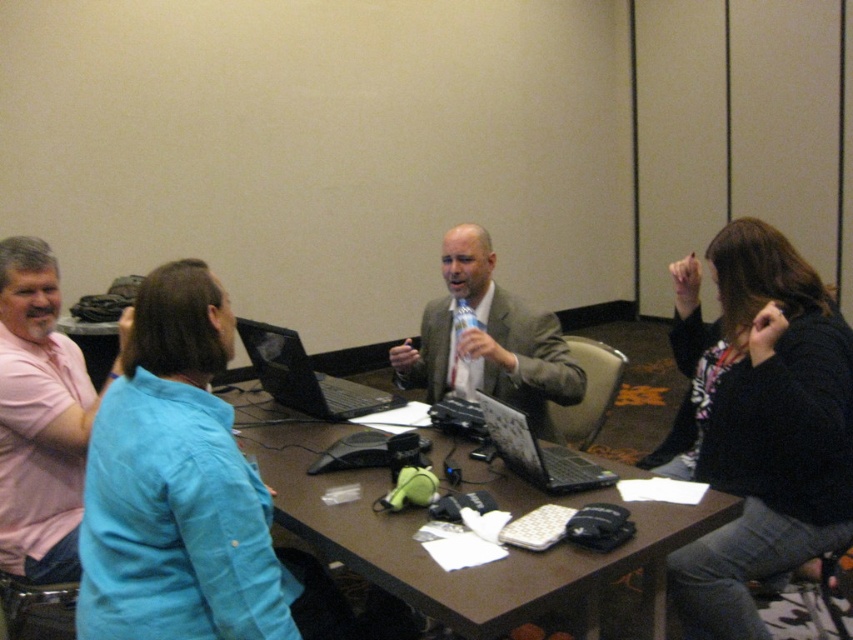
Question: Based on their relative distances, which object is nearer to the black sweater at right?

Choices:
 (A) gray suit jacket at center
 (B) pink cotton shirt at left
 (C) silver metallic laptop at center

Answer: (C)

Question: Which of these objects is positioned farthest from the pink cotton shirt at left?

Choices:
 (A) black matte laptop at center
 (B) gray suit jacket at center
 (C) brown wooden table at center
 (D) silver metallic laptop at center

Answer: (B)

Question: Is brown wooden table at center further to the viewer compared to gray suit jacket at center?

Choices:
 (A) no
 (B) yes

Answer: (A)

Question: Is brown wooden table at center further to camera compared to silver metallic laptop at center?

Choices:
 (A) no
 (B) yes

Answer: (A)

Question: Among these points, which one is farthest from the camera?

Choices:
 (A) (273, 336)
 (B) (70, 467)
 (C) (798, 368)
 (D) (521, 620)

Answer: (A)

Question: From the image, what is the correct spatial relationship of pink cotton shirt at left in relation to black matte laptop at center?

Choices:
 (A) above
 (B) below

Answer: (B)